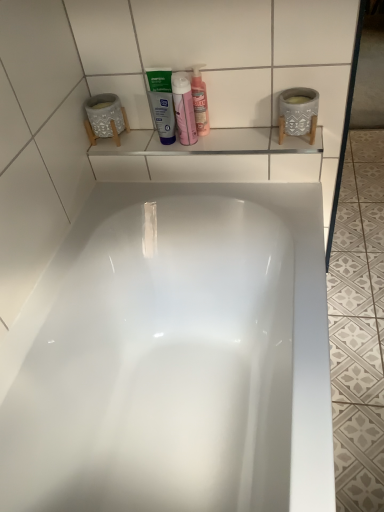
Question: Does translucent plastic bottle at upper center have a larger size compared to white matte tube at center?

Choices:
 (A) yes
 (B) no

Answer: (A)

Question: Is translucent plastic bottle at upper center looking in the opposite direction of white matte tube at center?

Choices:
 (A) yes
 (B) no

Answer: (B)

Question: Does translucent plastic bottle at upper center touch white matte tube at center?

Choices:
 (A) yes
 (B) no

Answer: (A)

Question: Is translucent plastic bottle at upper center taller than white matte tube at center?

Choices:
 (A) yes
 (B) no

Answer: (A)

Question: From the image's perspective, would you say translucent plastic bottle at upper center is positioned over white matte tube at center?

Choices:
 (A) yes
 (B) no

Answer: (A)

Question: Is translucent plastic bottle at upper center thinner than white matte tube at center?

Choices:
 (A) no
 (B) yes

Answer: (A)

Question: From the image's perspective, does white matte tube at center appear lower than white glossy bathtub at center?

Choices:
 (A) no
 (B) yes

Answer: (A)

Question: Does white matte tube at center appear on the right side of white glossy bathtub at center?

Choices:
 (A) no
 (B) yes

Answer: (A)

Question: Does white matte tube at center appear on the left side of white glossy bathtub at center?

Choices:
 (A) no
 (B) yes

Answer: (B)

Question: From a real-world perspective, is white matte tube at center on white glossy bathtub at center?

Choices:
 (A) yes
 (B) no

Answer: (A)

Question: Is white matte tube at center smaller than white glossy bathtub at center?

Choices:
 (A) yes
 (B) no

Answer: (A)

Question: Is white matte tube at center aimed at white glossy bathtub at center?

Choices:
 (A) no
 (B) yes

Answer: (A)

Question: From a real-world perspective, is white glossy bathtub at center physically above translucent plastic bottle at upper center?

Choices:
 (A) no
 (B) yes

Answer: (A)